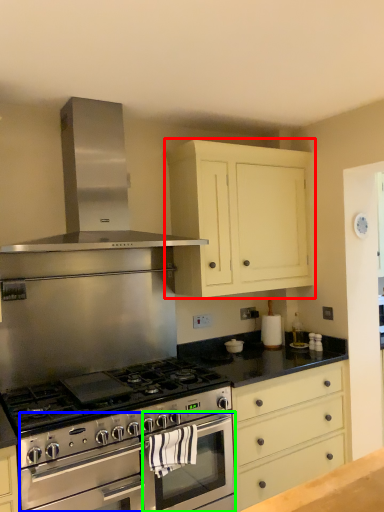
Question: Considering the real-world distances, which object is closest to cabinetry (highlighted by a red box)? oven (highlighted by a blue box) or oven (highlighted by a green box).

Choices:
 (A) oven
 (B) oven

Answer: (B)